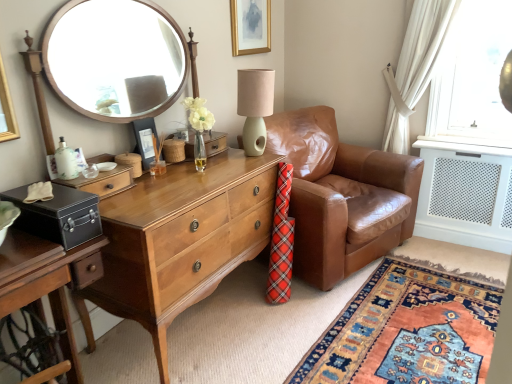
Find the location of a particular element. This screenshot has height=384, width=512. free point to the right of matte brown drawer at center is located at coordinates (138, 193).